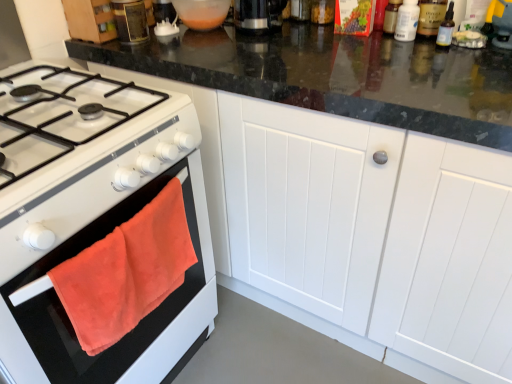
The image size is (512, 384). In order to click on vacant area in front of metallic canister at upper left in this screenshot , I will do tap(140, 49).